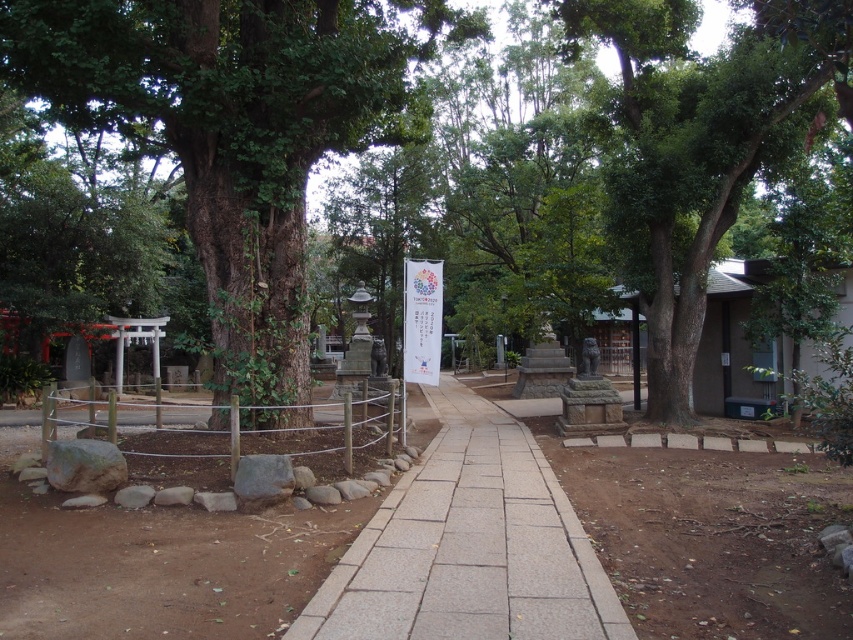
Question: Does green rough bark tree at center appear under green leafy tree at center?

Choices:
 (A) yes
 (B) no

Answer: (B)

Question: Which of these objects is positioned closest to the green leafy tree at center?

Choices:
 (A) green rough bark tree at center
 (B) gray stone pavement at center

Answer: (B)

Question: Estimate the real-world distances between objects in this image. Which object is farther from the green rough bark tree at center?

Choices:
 (A) gray stone pavement at center
 (B) green leafy tree at center

Answer: (B)

Question: Which point is closer to the camera?

Choices:
 (A) (560, 502)
 (B) (161, 32)

Answer: (A)

Question: Does green leafy tree at center come in front of gray stone pavement at center?

Choices:
 (A) yes
 (B) no

Answer: (B)

Question: Is green leafy tree at center thinner than gray stone pavement at center?

Choices:
 (A) no
 (B) yes

Answer: (A)